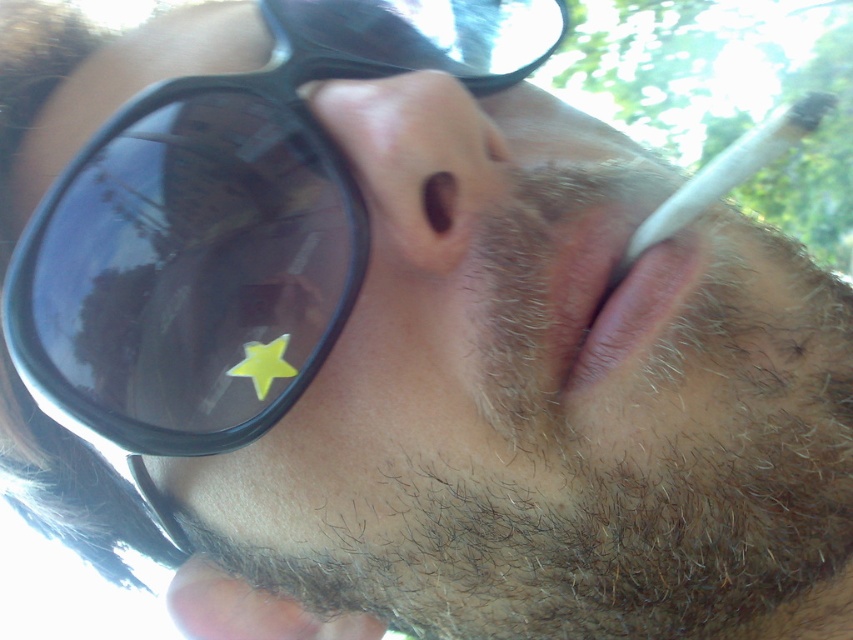
Consider the image. Is white paper cigarette at upper right below yellow matte star at lower left?

Actually, white paper cigarette at upper right is above yellow matte star at lower left.

Who is more distant from viewer, (650, 241) or (281, 369)?

The point (281, 369) is more distant.

This screenshot has width=853, height=640. In order to click on white paper cigarette at upper right in this screenshot , I will do `click(729, 170)`.

Does pink smooth lips at center lie behind yellow matte star at lower left?

No, it is not.

Find the location of a particular element. The image size is (853, 640). pink smooth lips at center is located at coordinates (611, 300).

Is black matte sunglasses at upper left closer to the viewer compared to brown matte nose at center?

No, it is behind brown matte nose at center.

Can you confirm if black matte sunglasses at upper left is taller than brown matte nose at center?

Indeed, black matte sunglasses at upper left has a greater height compared to brown matte nose at center.

Which is behind, point (482, 17) or point (462, 182)?

Point (482, 17)

Locate an element on the screen. black matte sunglasses at upper left is located at coordinates (227, 224).